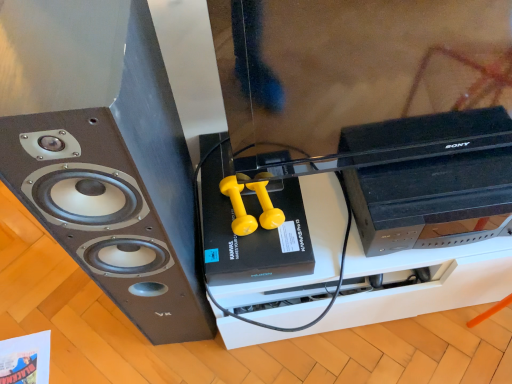
This screenshot has width=512, height=384. Identify the location of free space in front of black matte speaker at left. (189, 365).